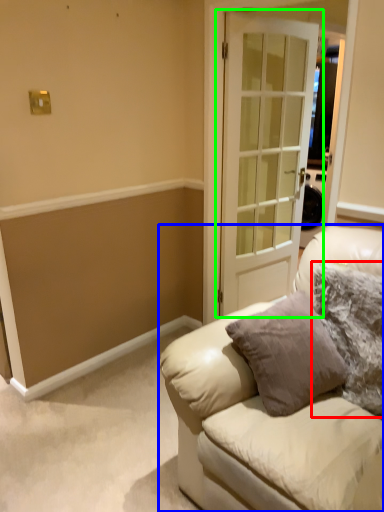
Question: Based on their relative distances, which object is nearer to pillow (highlighted by a red box)? Choose from studio couch (highlighted by a blue box) and door (highlighted by a green box).

Choices:
 (A) studio couch
 (B) door

Answer: (A)